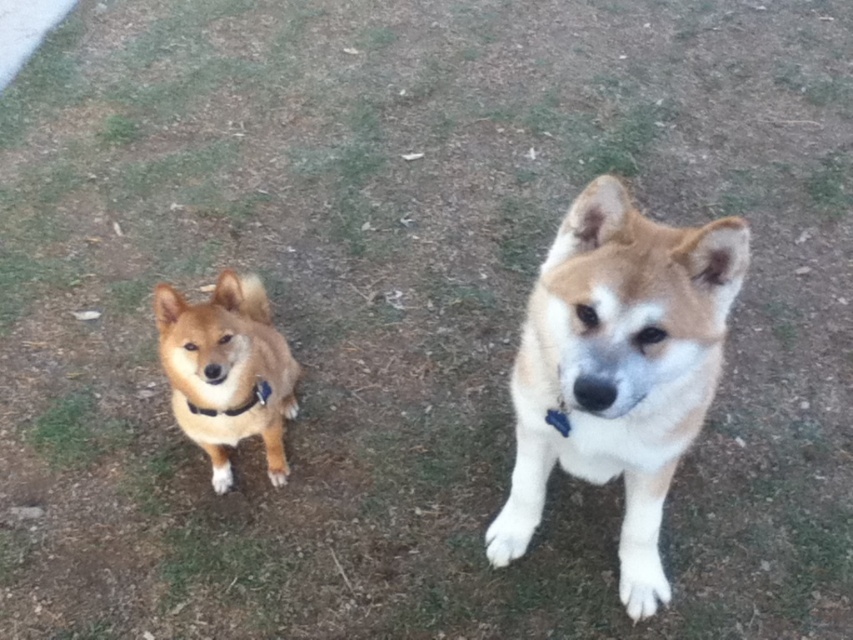
Which is behind, point (218, 444) or point (201, 408)?

The point (218, 444) is behind.

Is golden fur dog at center smaller than black fabric neckband at center?

Actually, golden fur dog at center might be larger than black fabric neckband at center.

Which is behind, point (210, 422) or point (254, 400)?

The point (254, 400) is behind.

Locate an element on the screen. The height and width of the screenshot is (640, 853). golden fur dog at center is located at coordinates (227, 371).

Who is more forward, (x=689, y=355) or (x=254, y=320)?

Positioned in front is point (x=689, y=355).

Which is behind, point (729, 300) or point (270, 394)?

The point (270, 394) is behind.

The width and height of the screenshot is (853, 640). I want to click on light brown fur dog at center, so click(618, 369).

You are a GUI agent. You are given a task and a screenshot of the screen. Output one action in this format:
    pyautogui.click(x=<x>, y=<y>)
    Task: Click on the light brown fur dog at center
    This screenshot has height=640, width=853.
    Given the screenshot: What is the action you would take?
    pyautogui.click(x=618, y=369)